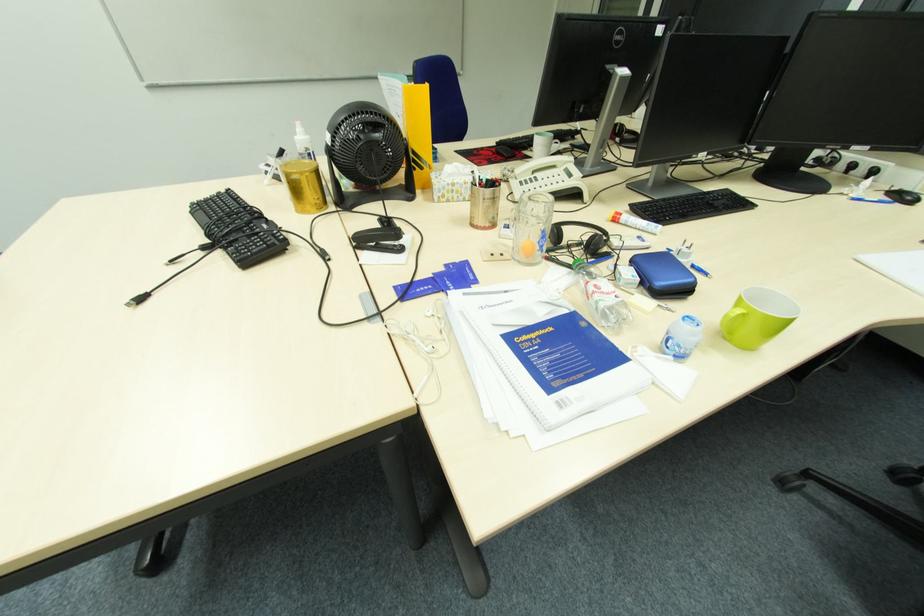
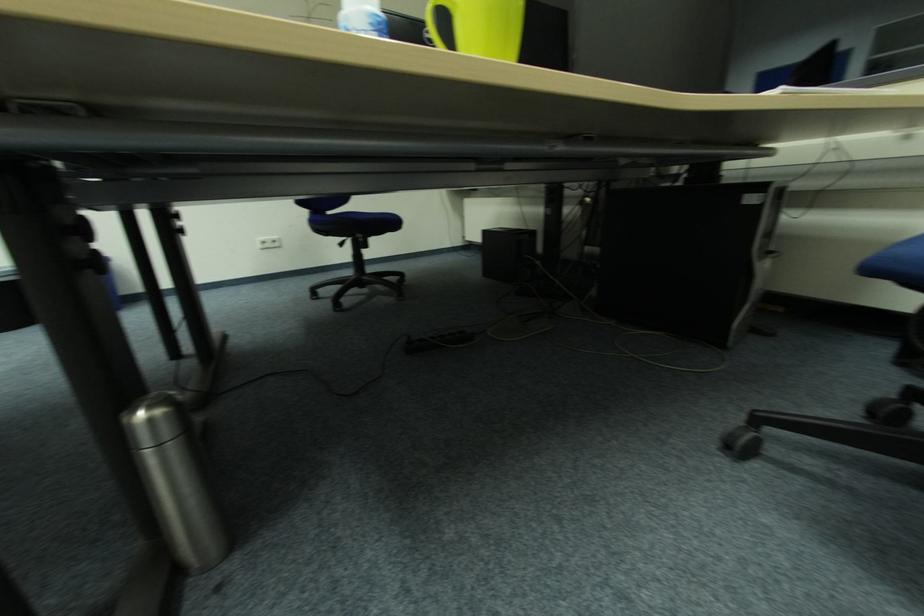
What movement of the cameraman would produce the second image?

The cameraman moved toward right, forward.